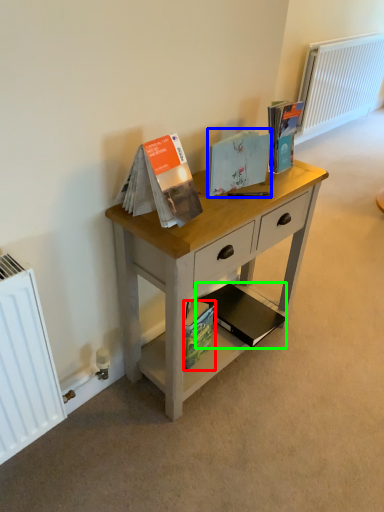
Question: Which object is the closest to the paperback book (highlighted by a red box)? Choose among these: paperback book (highlighted by a blue box) or paperback book (highlighted by a green box).

Choices:
 (A) paperback book
 (B) paperback book

Answer: (B)